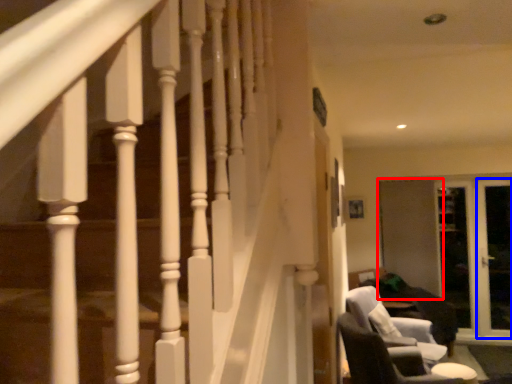
Question: Which object is further to the camera taking this photo, screen door (highlighted by a red box) or screen door (highlighted by a blue box)?

Choices:
 (A) screen door
 (B) screen door

Answer: (A)